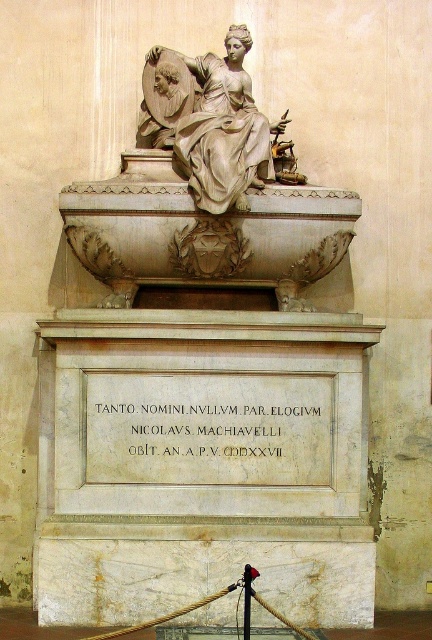
Between white marble statue at center and polished marble statue at upper center, which one has less height?

polished marble statue at upper center is shorter.

Which is behind, point (177, 202) or point (267, 172)?

The point (267, 172) is behind.

Which is in front, point (282, 161) or point (257, 154)?

Point (257, 154) is in front.

Find the location of a particular element. Image resolution: width=432 pixels, height=640 pixels. white marble statue at center is located at coordinates (206, 193).

Measure the distance between black stone inscription at center and camera.

black stone inscription at center and camera are 75.77 feet apart.

Who is more forward, (260, 394) or (231, 38)?

Point (260, 394)

Is point (129, 452) less distant than point (181, 134)?

Yes, point (129, 452) is in front of point (181, 134).

Identify the location of black stone inscription at center. The height and width of the screenshot is (640, 432). (209, 428).

Which of these two, white marble statue at center or black stone inscription at center, stands shorter?

black stone inscription at center

Between white marble statue at center and black stone inscription at center, which one appears on the left side from the viewer's perspective?

From the viewer's perspective, black stone inscription at center appears more on the left side.

Is point (89, 228) in front of point (213, 419)?

No, it is behind (213, 419).

The image size is (432, 640). I want to click on white marble statue at center, so click(206, 193).